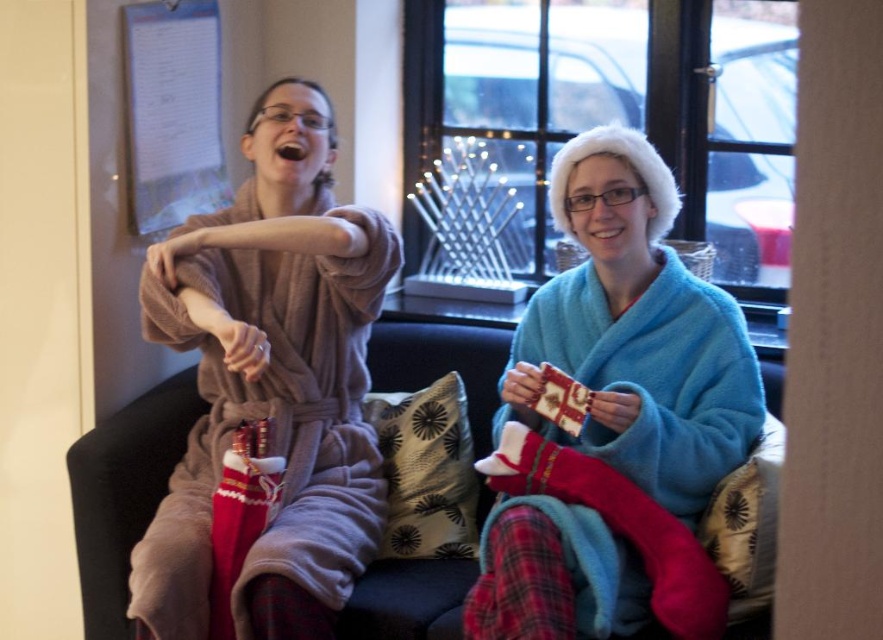
You are standing in the living room and want to give a gift to the person wearing the soft brown robe at left. Which direction should you approach from to avoid the blue fuzzy robe at center?

You should approach from the left side of the soft brown robe at left since the blue fuzzy robe at center is to the right of it, so moving left would avoid obstruction.

You are a tailor measuring fabrics to create a new cushion for the velvet couch at center. The blue fuzzy robe at center is currently placed on the couch. If the robe is wider than the couch, will it hang over the edges when placed on the couch?

The blue fuzzy robe at center is wider than the velvet couch at center, so when placed on the couch, it will hang over the edges.

You are standing in the living room and want to place a small plant between the two points, point (x=502, y=358) and point (x=155, y=161). Which point should the plant be closer to if you want it to be nearer to the viewer?

The plant should be placed closer to point (x=502, y=358) because it is further to the viewer than point (x=155, y=161).